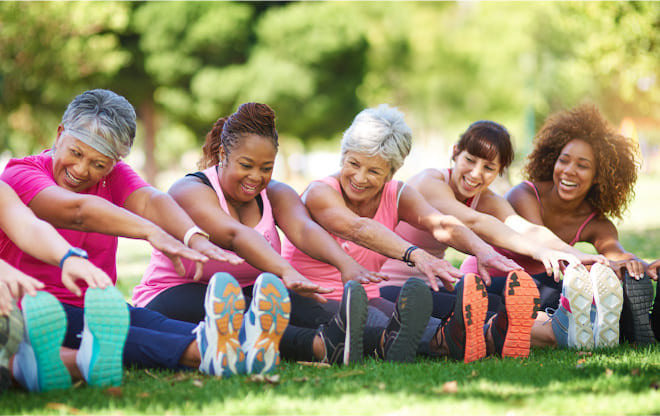
At what (x,y) coordinates should I click in order to perform the action: click on pairs of shoes. Please return your answer as a coordinate pair (x, y). This screenshot has width=660, height=416. Looking at the image, I should click on (84, 356), (228, 334), (399, 339), (472, 336), (575, 316).